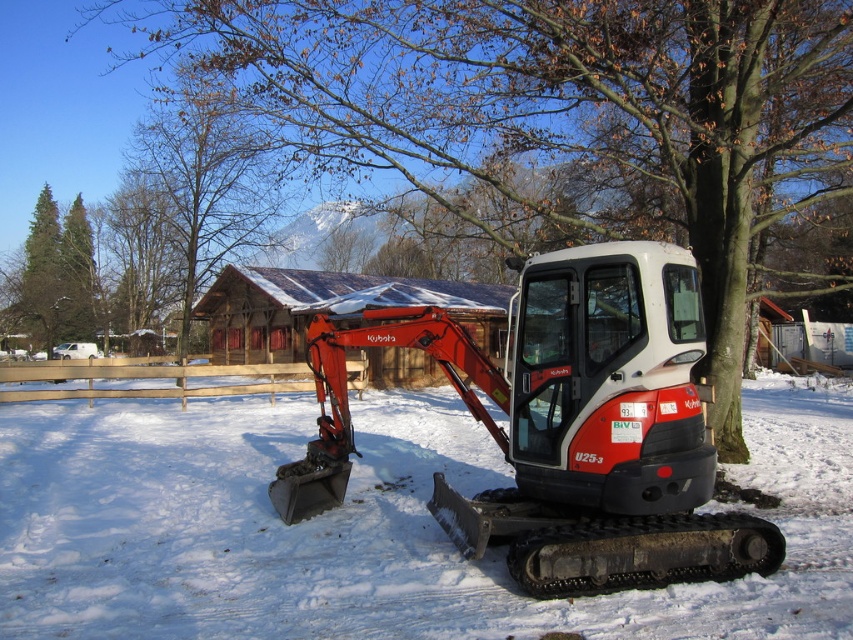
Question: Which is nearer to the white powdery snow at center?

Choices:
 (A) green coniferous trees at left
 (B) bare wood tree at upper center

Answer: (B)

Question: Which object is closer to the camera taking this photo?

Choices:
 (A) white powdery snow at center
 (B) red matte excavator at center

Answer: (A)

Question: Which of the following is the farthest from the observer?

Choices:
 (A) green coniferous trees at left
 (B) brown textured tree at center
 (C) bare wood tree at upper center
 (D) red matte excavator at center

Answer: (A)

Question: Is brown textured tree at center above white powdery snow at center?

Choices:
 (A) no
 (B) yes

Answer: (B)

Question: Is brown textured tree at center closer to the viewer compared to red matte excavator at center?

Choices:
 (A) no
 (B) yes

Answer: (A)

Question: Is brown textured tree at center thinner than red matte excavator at center?

Choices:
 (A) yes
 (B) no

Answer: (B)